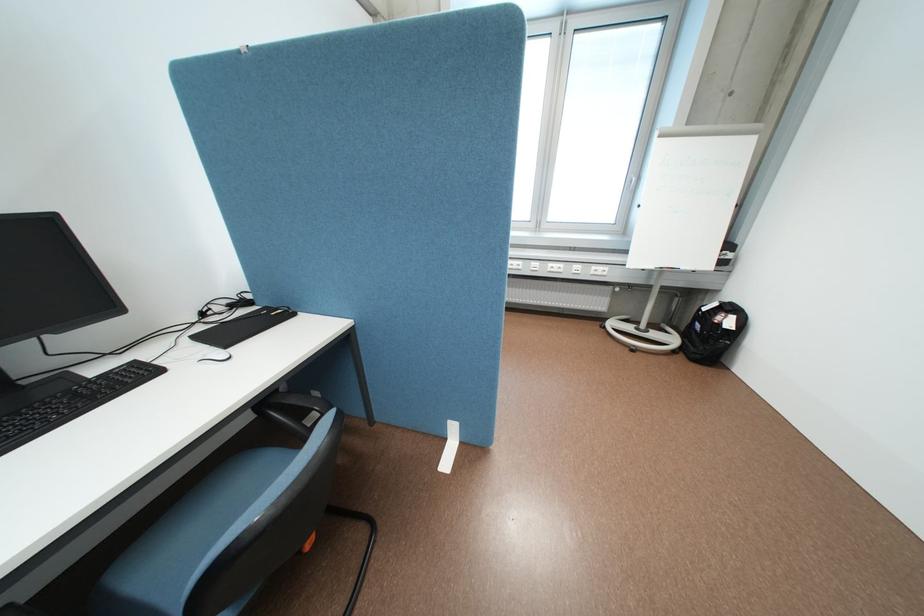
What do you see at coordinates (282, 416) in the screenshot? This screenshot has height=616, width=924. I see `the black chair armrest` at bounding box center [282, 416].